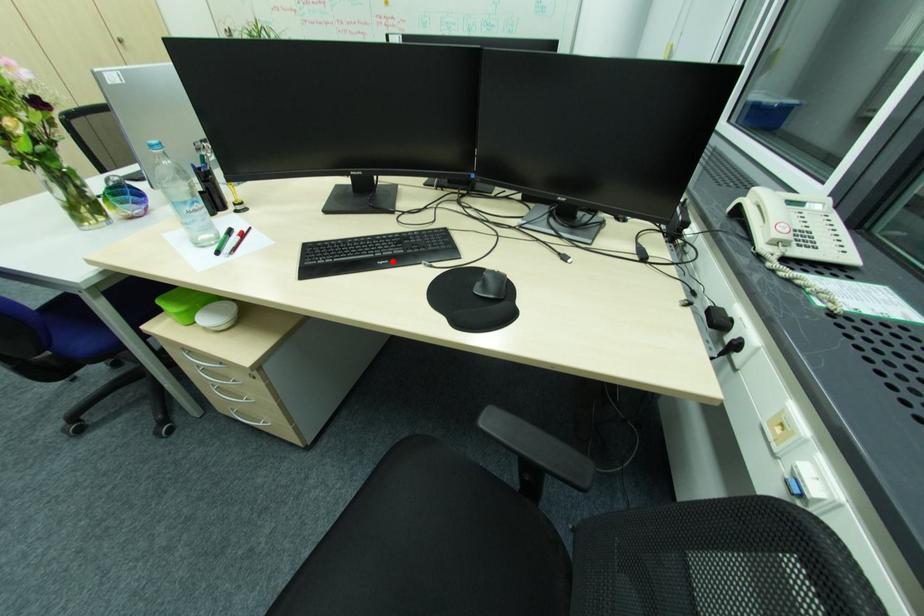
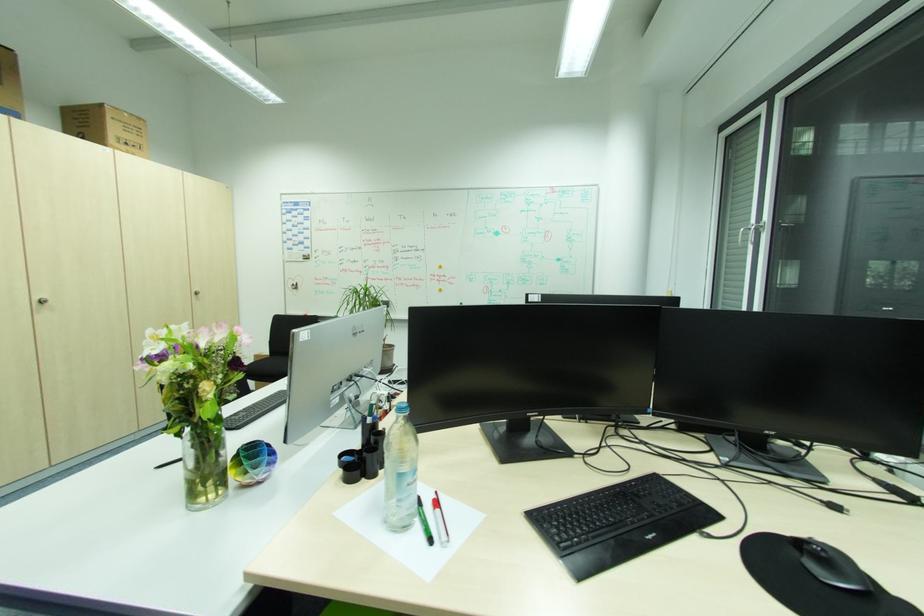
Locate, in the second image, the point that corresponds to the highlighted location in the first image.

(660, 533)